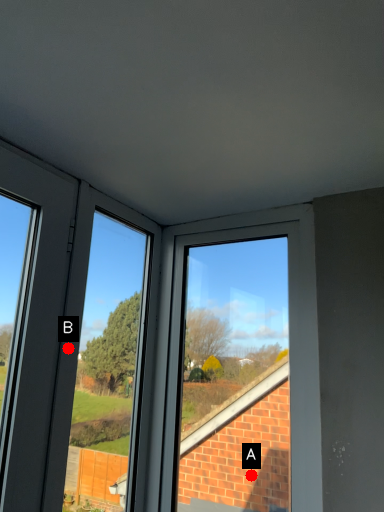
Question: Two points are circled on the image, labeled by A and B beside each circle. Which point is closer to the camera?

Choices:
 (A) A is closer
 (B) B is closer

Answer: (B)